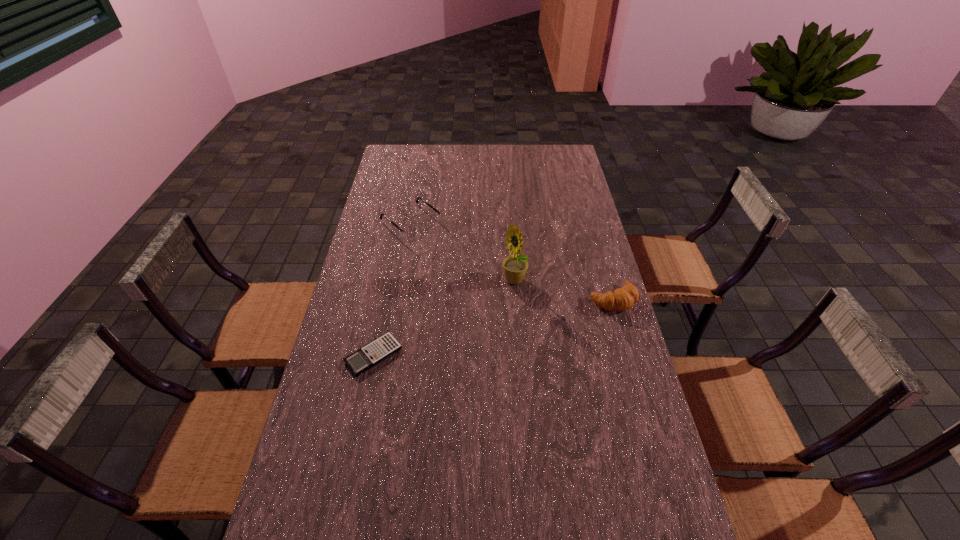
Where is `the nearest object`? The height and width of the screenshot is (540, 960). the nearest object is located at coordinates (385, 346).

The image size is (960, 540). In order to click on calculator in this screenshot , I will do `click(385, 346)`.

Where is `crescent roll`? The image size is (960, 540). crescent roll is located at coordinates (624, 298).

This screenshot has width=960, height=540. I want to click on the tallest object, so click(515, 266).

Where is `the third object from left to right`? The image size is (960, 540). the third object from left to right is located at coordinates (515, 266).

Locate an element on the screen. The height and width of the screenshot is (540, 960). spectacles is located at coordinates (410, 232).

You are a GUI agent. You are given a task and a screenshot of the screen. Output one action in this format:
    pyautogui.click(x=<x>, y=<y>)
    Task: Click on the vacant space located on the front of the shortest object
    
    Given the screenshot: What is the action you would take?
    pyautogui.click(x=356, y=440)

Locate an element on the screen. The height and width of the screenshot is (540, 960). vacant space located 0.310m on the left of the rightmost object is located at coordinates (496, 299).

This screenshot has width=960, height=540. What are the coordinates of `vacant space located on the face of the tallest object` in the screenshot? It's located at (492, 315).

Where is `free space located 0.220m on the face of the tallest object`? free space located 0.220m on the face of the tallest object is located at coordinates point(478,337).